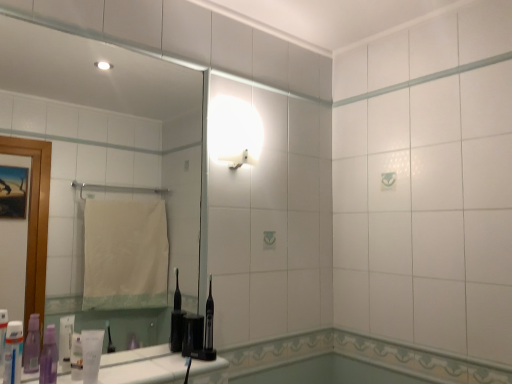
Question: Considering the relative sizes of white matte tube at lower left, acting as the first toiletry starting from the right, and clear glass mirror at upper left in the image provided, is white matte tube at lower left, acting as the first toiletry starting from the right, smaller than clear glass mirror at upper left?

Choices:
 (A) yes
 (B) no

Answer: (A)

Question: Does white matte tube at lower left, acting as the 4th toiletry starting from the left, contain clear glass mirror at upper left?

Choices:
 (A) yes
 (B) no

Answer: (B)

Question: Is white matte tube at lower left, acting as the first toiletry starting from the right, bigger than clear glass mirror at upper left?

Choices:
 (A) no
 (B) yes

Answer: (A)

Question: Is white matte tube at lower left, acting as the first toiletry starting from the right, facing away from clear glass mirror at upper left?

Choices:
 (A) no
 (B) yes

Answer: (B)

Question: From the image's perspective, is white matte tube at lower left, acting as the first toiletry starting from the right, below clear glass mirror at upper left?

Choices:
 (A) yes
 (B) no

Answer: (A)

Question: Does white matte tube at lower left, acting as the first toiletry starting from the right, have a greater height compared to clear glass mirror at upper left?

Choices:
 (A) yes
 (B) no

Answer: (B)

Question: Is clear glass mirror at upper left looking in the opposite direction of translucent plastic toothpaste tube at lower left, which is the second toiletry from right to left?

Choices:
 (A) no
 (B) yes

Answer: (B)

Question: From the image's perspective, is clear glass mirror at upper left under translucent plastic toothpaste tube at lower left, which is the second toiletry from right to left?

Choices:
 (A) yes
 (B) no

Answer: (B)

Question: Can you confirm if clear glass mirror at upper left is thinner than translucent plastic toothpaste tube at lower left, marked as the third toiletry in a left-to-right arrangement?

Choices:
 (A) no
 (B) yes

Answer: (A)

Question: Considering the relative sizes of clear glass mirror at upper left and translucent plastic toothpaste tube at lower left, which is the second toiletry from right to left, in the image provided, is clear glass mirror at upper left taller than translucent plastic toothpaste tube at lower left, which is the second toiletry from right to left,?

Choices:
 (A) yes
 (B) no

Answer: (A)

Question: Is clear glass mirror at upper left next to translucent plastic toothpaste tube at lower left, marked as the third toiletry in a left-to-right arrangement?

Choices:
 (A) no
 (B) yes

Answer: (A)

Question: Does clear glass mirror at upper left have a lesser height compared to translucent plastic toothpaste tube at lower left, which is the second toiletry from right to left?

Choices:
 (A) no
 (B) yes

Answer: (A)

Question: Is translucent plastic toothpaste tube at lower left, the first toiletry in the left-to-right sequence, to the right of white glossy light fixture at upper center from the viewer's perspective?

Choices:
 (A) yes
 (B) no

Answer: (B)